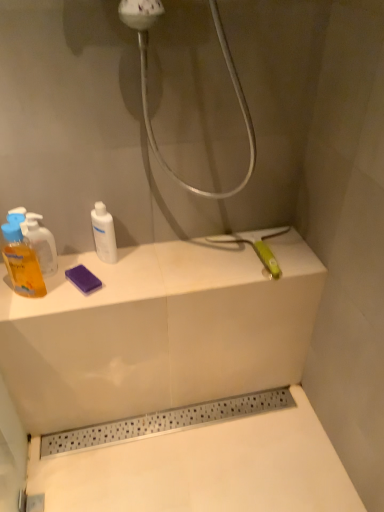
Where is `vacant space to the right of translucent yellow liquid at left, the first mouthwash when ordered from left to right`? The image size is (384, 512). vacant space to the right of translucent yellow liquid at left, the first mouthwash when ordered from left to right is located at coordinates (91, 287).